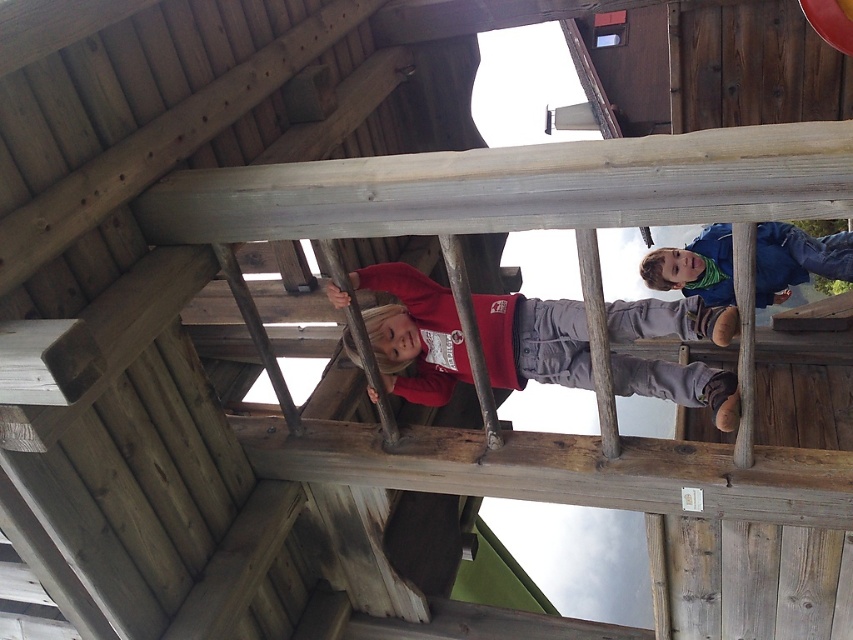
Based on the photo, you are a photographer trying to capture both children in a single shot. Since the matte red hoodie at center and the blue fleece jacket at upper center are at different heights, which child should you adjust your camera angle to focus on first to ensure both are in frame?

The matte red hoodie at center is taller than the blue fleece jacket at upper center, so you should focus on the taller child first to ensure both are in frame.

You are standing at the center of the playground structure and want to locate the matte red hoodie at center. According to the coordinates provided, where would you find it?

The matte red hoodie at center is located at the coordinates point (418, 332), which is slightly to the right and just below the center of the playground structure.

You are a parent standing at the entrance of the playground. You see your child wearing a matte red hoodie at center and another child wearing a blue fleece jacket at upper center. Which child is closer to you?

The matte red hoodie at center is closer to you since it is only 5.83 feet away from the blue fleece jacket at upper center, meaning the red hoodie is in front of the blue jacket.